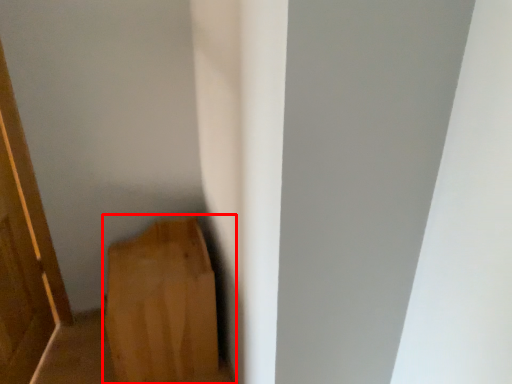
Question: From the image's perspective, what is the correct spatial relationship of furniture (annotated by the red box) in relation to door?

Choices:
 (A) below
 (B) above

Answer: (A)